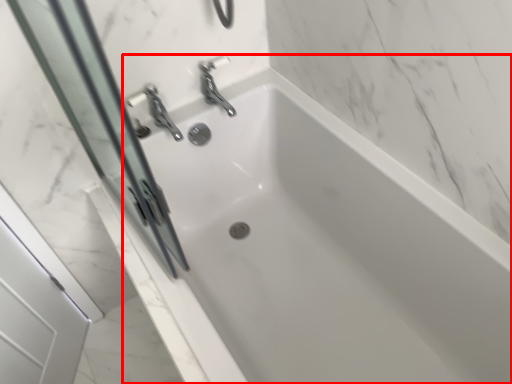
Question: From the image's perspective, what is the correct spatial relationship of bathtub (annotated by the red box) in relation to screen door?

Choices:
 (A) above
 (B) below

Answer: (B)